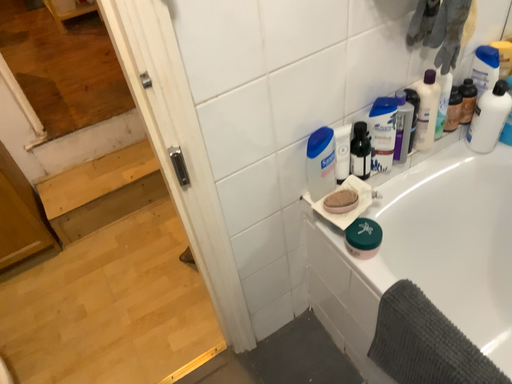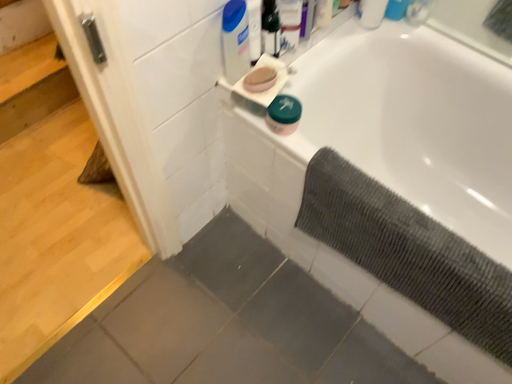
Question: How did the camera likely rotate when shooting the video?

Choices:
 (A) rotated upward
 (B) rotated downward

Answer: (B)